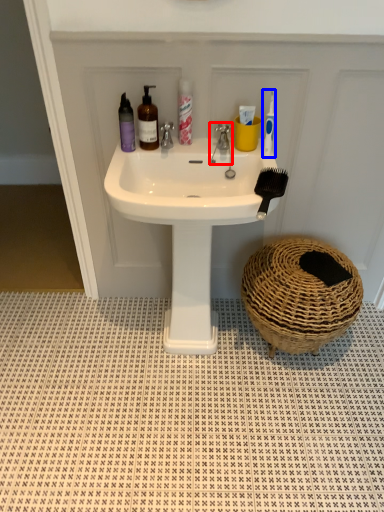
Question: Which of the following is the closest to the observer, tap (highlighted by a red box) or toothbrush (highlighted by a blue box)?

Choices:
 (A) tap
 (B) toothbrush

Answer: (B)